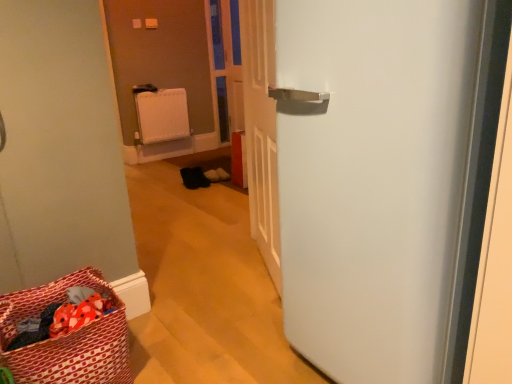
Question: From a real-world perspective, relative to red fabric laundry basket at lower left, is transparent plastic screen door at center vertically above or below?

Choices:
 (A) below
 (B) above

Answer: (B)

Question: Considering the positions of transparent plastic screen door at center and red fabric laundry basket at lower left in the image, is transparent plastic screen door at center taller or shorter than red fabric laundry basket at lower left?

Choices:
 (A) short
 (B) tall

Answer: (B)

Question: Based on their relative distances, which object is farther from the white plastic radiator at center?

Choices:
 (A) white matte refrigerator at right
 (B) transparent plastic screen door at center
 (C) red fabric laundry basket at lower left

Answer: (A)

Question: Which object is positioned farthest from the transparent plastic screen door at center?

Choices:
 (A) white matte refrigerator at right
 (B) red fabric laundry basket at lower left
 (C) white plastic radiator at center

Answer: (A)